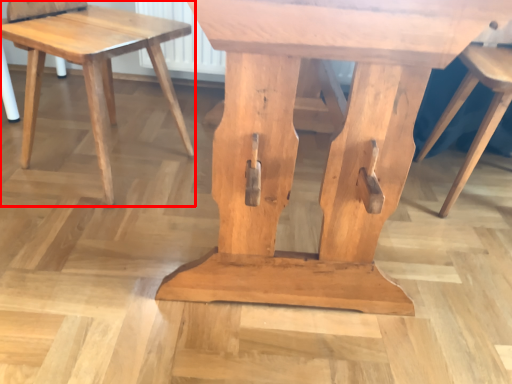
Question: From the image's perspective, where is stool (annotated by the red box) located in relation to stool in the image?

Choices:
 (A) above
 (B) below

Answer: (A)